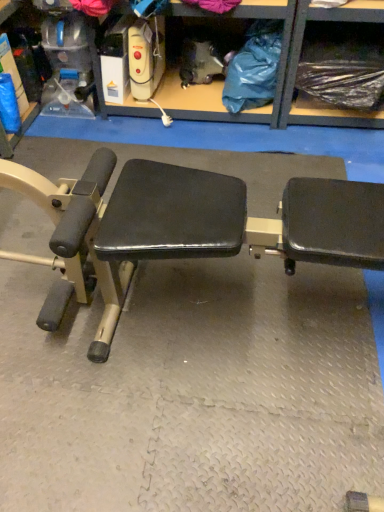
The height and width of the screenshot is (512, 384). What do you see at coordinates (294, 80) in the screenshot? I see `black plastic bag at upper right` at bounding box center [294, 80].

What is the approximate height of black plastic bag at upper right?

11.79 inches.

Locate an element on the screen. This screenshot has height=512, width=384. black plastic bag at upper right is located at coordinates point(294,80).

At what (x,y) coordinates should I click in order to perform the action: click on black plastic bag at upper right. Please return your answer as a coordinate pair (x, y). The image size is (384, 512). Looking at the image, I should click on (294, 80).